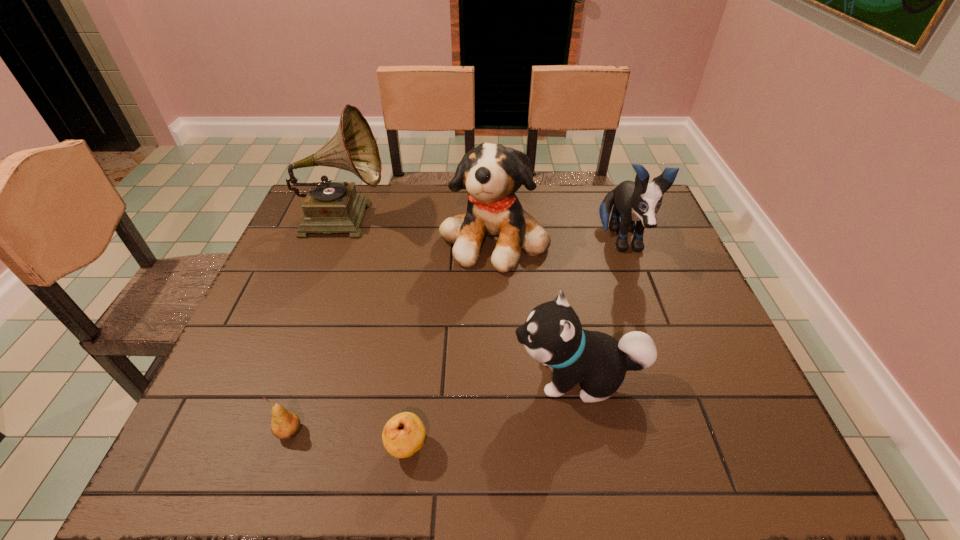
Identify which object is located as the nearest to the third shortest object. Please provide its 2D coordinates. Your answer should be formatted as a tuple, i.e. [(x, y)], where the tuple contains the x and y coordinates of a point satisfying the conditions above.

[(404, 434)]

Select which object is the closest to the record player. Please provide its 2D coordinates. Your answer should be formatted as a tuple, i.e. [(x, y)], where the tuple contains the x and y coordinates of a point satisfying the conditions above.

[(491, 173)]

The image size is (960, 540). In order to click on puppy that stands as the closest to the right pear in this screenshot , I will do `click(552, 335)`.

Identify which puppy is located as the nearest to the right pear. Please provide its 2D coordinates. Your answer should be formatted as a tuple, i.e. [(x, y)], where the tuple contains the x and y coordinates of a point satisfying the conditions above.

[(552, 335)]

Find the location of a particular element. The width and height of the screenshot is (960, 540). vacant region that satisfies the following two spatial constraints: 1. on the back side of the left pear; 2. from the horn of the record player is located at coordinates (360, 217).

The image size is (960, 540). What are the coordinates of `free spot that satisfies the following two spatial constraints: 1. on the back side of the left pear; 2. from the horn of the record player` in the screenshot? It's located at (360, 217).

Where is `vacant space that satisfies the following two spatial constraints: 1. from the horn of the right pear; 2. on the right side of the record player`? vacant space that satisfies the following two spatial constraints: 1. from the horn of the right pear; 2. on the right side of the record player is located at coordinates (257, 447).

What are the coordinates of `free space that satisfies the following two spatial constraints: 1. from the horn of the record player; 2. on the right side of the left pear` in the screenshot? It's located at (263, 431).